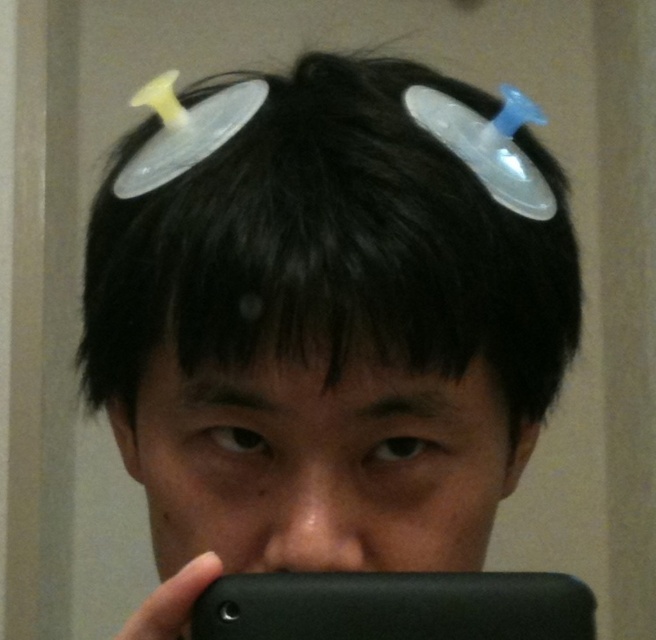
Question: Where is black matte hair at upper center located in relation to black matte smartphone at lower center in the image?

Choices:
 (A) left
 (B) right

Answer: (A)

Question: From the image, what is the correct spatial relationship of black matte hair at upper center in relation to black matte smartphone at lower center?

Choices:
 (A) left
 (B) right

Answer: (A)

Question: Which object appears closest to the camera in this image?

Choices:
 (A) black matte smartphone at lower center
 (B) black matte hair at upper center

Answer: (B)

Question: Does black matte hair at upper center appear over black matte smartphone at lower center?

Choices:
 (A) no
 (B) yes

Answer: (B)